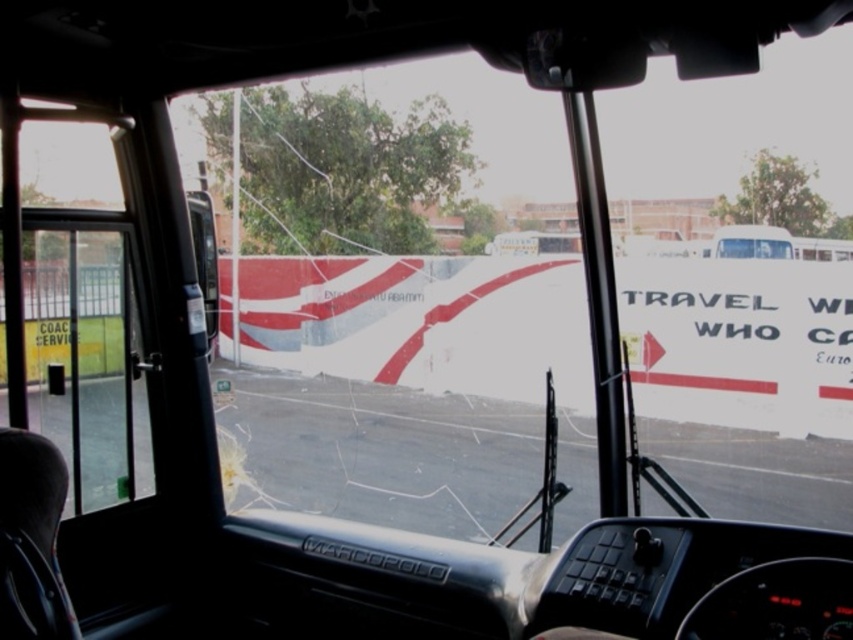
You are a passenger sitting in the front seat of the bus. You want to see the road ahead clearly through the transparent glass at center. However, there is a white glossy bus driver at center in your view. Which object is closer to you, the passenger, so that you can focus on it first?

The transparent glass at center is closer to the viewer than the white glossy bus driver at center, so you can focus on the transparent glass at center first.

You are a passenger sitting in the back of the bus and want to look at the advertisement outside through the transparent glass at center. However, the white glossy bus driver at center is blocking your view. Can you see the advertisement clearly?

The transparent glass at center is much taller than the white glossy bus driver at center, so you can see the advertisement outside through the transparent glass at center as the driver is shorter and not fully obstructing the view.

You are a passenger sitting in the bus and looking through the windshield. There are two points marked on the windshield at coordinates point [321,256] and point [97,147]. Which point is closer to your eyes?

Point [97,147] is closer to your eyes because it is closer to the camera than point [321,256].